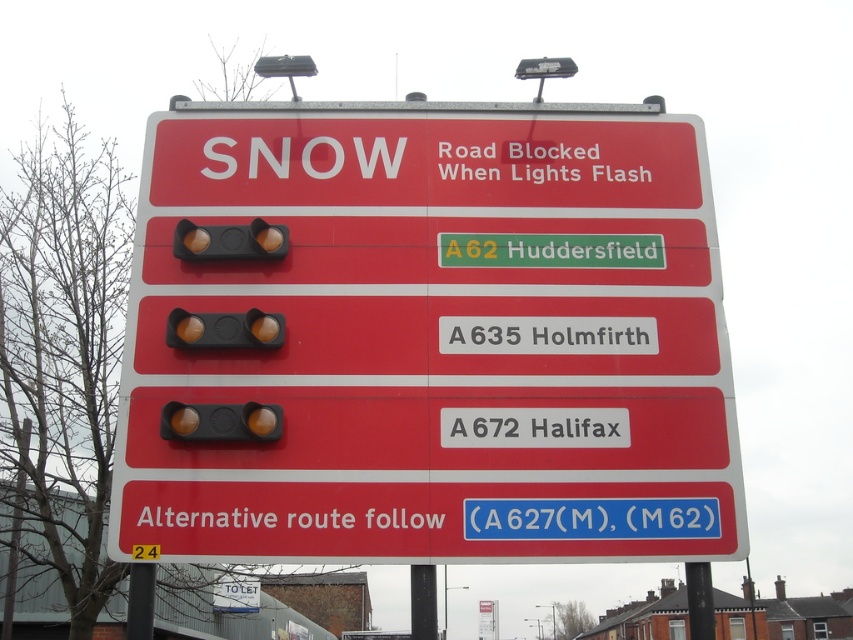
Question: Which object is positioned farthest from the matte yellow traffic light at upper center?

Choices:
 (A) black metal pole at center
 (B) matte black traffic light at center
 (C) metallic pole at center

Answer: (C)

Question: Which object is positioned closest to the yellow translucent traffic light at center?

Choices:
 (A) matte black traffic light at center
 (B) metallic pole at center
 (C) red plastic sign at center

Answer: (A)

Question: From the image, what is the correct spatial relationship of matte black traffic light at center in relation to matte yellow traffic light at upper center?

Choices:
 (A) above
 (B) below

Answer: (B)

Question: Among these objects, which one is farthest from the camera?

Choices:
 (A) matte black traffic light at center
 (B) metallic pole at center
 (C) black metal pole at center

Answer: (B)

Question: Is matte yellow traffic light at upper center positioned at the back of metallic pole at center?

Choices:
 (A) no
 (B) yes

Answer: (B)

Question: Is red plastic sign at center wider than matte yellow traffic light at upper center?

Choices:
 (A) no
 (B) yes

Answer: (B)